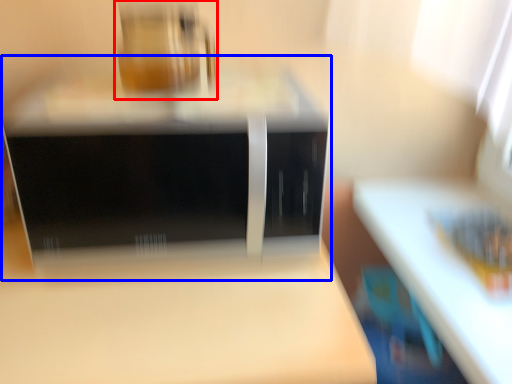
Question: Among these objects, which one is farthest to the camera, appliance (highlighted by a red box) or home appliance (highlighted by a blue box)?

Choices:
 (A) appliance
 (B) home appliance

Answer: (A)